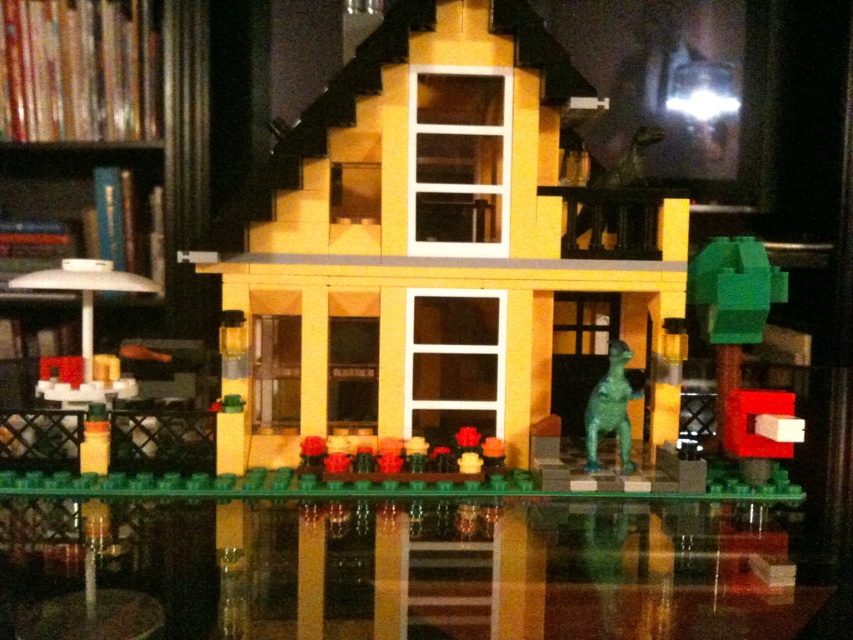
Question: Which point appears farthest from the camera in this image?

Choices:
 (A) (126, 154)
 (B) (347, 564)
 (C) (251, 336)

Answer: (A)

Question: Is transparent glass table at lower center smaller than green metallic dinosaur at center?

Choices:
 (A) yes
 (B) no

Answer: (B)

Question: Is yellow matte house at center behind transparent glass table at lower center?

Choices:
 (A) yes
 (B) no

Answer: (A)

Question: Does yellow matte house at center lie behind white plastic bookshelf at left?

Choices:
 (A) yes
 (B) no

Answer: (A)

Question: Which point appears farthest from the camera in this image?

Choices:
 (A) (610, 349)
 (B) (189, 104)
 (C) (561, 602)

Answer: (B)

Question: Which object is the closest to the transparent glass table at lower center?

Choices:
 (A) yellow matte house at center
 (B) white plastic bookshelf at left

Answer: (A)